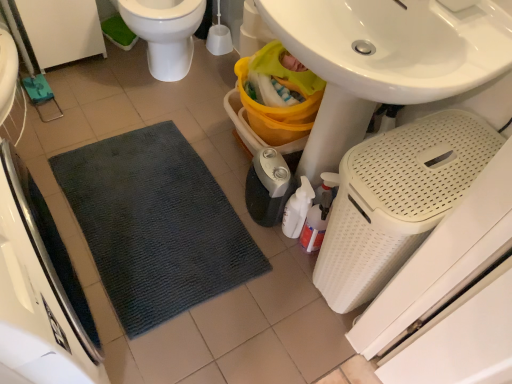
Question: Is black plastic humidifier at lower center, the 2th appliance from the right, at the back of white perforated laundry basket at lower right, arranged as the 1th appliance when viewed from the right?

Choices:
 (A) no
 (B) yes

Answer: (A)

Question: Considering the relative sizes of white perforated laundry basket at lower right, the 3th appliance when ordered from left to right, and black plastic humidifier at lower center, the second appliance when ordered from left to right, in the image provided, is white perforated laundry basket at lower right, the 3th appliance when ordered from left to right, smaller than black plastic humidifier at lower center, the second appliance when ordered from left to right,?

Choices:
 (A) no
 (B) yes

Answer: (A)

Question: Are white perforated laundry basket at lower right, the 3th appliance when ordered from left to right, and black plastic humidifier at lower center, the second appliance when ordered from left to right, beside each other?

Choices:
 (A) no
 (B) yes

Answer: (A)

Question: Considering the relative positions of white perforated laundry basket at lower right, the 3th appliance when ordered from left to right, and black plastic humidifier at lower center, the second appliance when ordered from left to right, in the image provided, is white perforated laundry basket at lower right, the 3th appliance when ordered from left to right, to the left of black plastic humidifier at lower center, the second appliance when ordered from left to right, from the viewer's perspective?

Choices:
 (A) no
 (B) yes

Answer: (A)

Question: From the image's perspective, is white perforated laundry basket at lower right, arranged as the 1th appliance when viewed from the right, located beneath black plastic humidifier at lower center, the 2th appliance from the right?

Choices:
 (A) no
 (B) yes

Answer: (B)

Question: Would you say white glossy toilet at upper left is inside or outside white perforated laundry basket at lower right, the 3th appliance when ordered from left to right?

Choices:
 (A) inside
 (B) outside

Answer: (B)

Question: In terms of width, does white glossy toilet at upper left look wider or thinner when compared to white perforated laundry basket at lower right, the 3th appliance when ordered from left to right?

Choices:
 (A) wide
 (B) thin

Answer: (A)

Question: Relative to white perforated laundry basket at lower right, arranged as the 1th appliance when viewed from the right, is white glossy toilet at upper left in front or behind?

Choices:
 (A) front
 (B) behind

Answer: (B)

Question: From the image's perspective, is white glossy toilet at upper left positioned above or below white perforated laundry basket at lower right, arranged as the 1th appliance when viewed from the right?

Choices:
 (A) below
 (B) above

Answer: (B)

Question: In terms of width, does dark gray textured mat at lower left, which ranks as the first appliance in left-to-right order, look wider or thinner when compared to translucent plastic spray bottle at lower center?

Choices:
 (A) thin
 (B) wide

Answer: (B)

Question: In terms of height, does dark gray textured mat at lower left, arranged as the 3th appliance when viewed from the right, look taller or shorter compared to translucent plastic spray bottle at lower center?

Choices:
 (A) tall
 (B) short

Answer: (A)

Question: From the image's perspective, is dark gray textured mat at lower left, arranged as the 3th appliance when viewed from the right, positioned above or below translucent plastic spray bottle at lower center?

Choices:
 (A) above
 (B) below

Answer: (B)

Question: Would you say dark gray textured mat at lower left, which ranks as the first appliance in left-to-right order, is to the left or to the right of translucent plastic spray bottle at lower center in the picture?

Choices:
 (A) left
 (B) right

Answer: (A)

Question: Considering their positions, is translucent plastic spray bottle at lower center located in front of or behind black plastic humidifier at lower center, the 2th appliance from the right?

Choices:
 (A) behind
 (B) front

Answer: (B)

Question: Considering the positions of translucent plastic spray bottle at lower center and black plastic humidifier at lower center, the second appliance when ordered from left to right, in the image, is translucent plastic spray bottle at lower center bigger or smaller than black plastic humidifier at lower center, the second appliance when ordered from left to right,?

Choices:
 (A) small
 (B) big

Answer: (A)